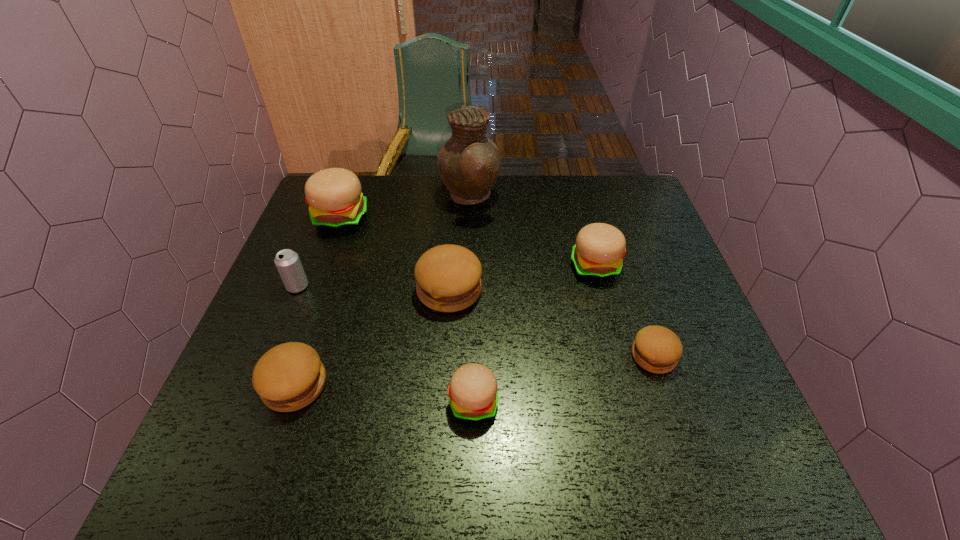
At what (x,y) coordinates should I click in order to perform the action: click on free space located on the back of the second beige hamburger from left to right. Please return your answer as a coordinate pair (x, y). Looking at the image, I should click on (475, 258).

Where is `vacant area situated 0.120m on the front of the shortest object`? vacant area situated 0.120m on the front of the shortest object is located at coordinates (678, 430).

This screenshot has width=960, height=540. Find the location of `pitcher that is at the far edge`. pitcher that is at the far edge is located at coordinates (469, 163).

At what (x,y) coordinates should I click in order to perform the action: click on hamburger that is at the far edge. Please return your answer as a coordinate pair (x, y). This screenshot has height=540, width=960. Looking at the image, I should click on (334, 196).

Identify the location of beer can that is at the left edge. (288, 264).

Image resolution: width=960 pixels, height=540 pixels. What are the coordinates of `object positioned at the far left corner` in the screenshot? It's located at (334, 196).

The image size is (960, 540). Identify the location of vacant space at the far edge. (372, 210).

Where is `free point at the left edge`? free point at the left edge is located at coordinates (309, 312).

Find the location of a particular element. vacant region at the right edge of the desktop is located at coordinates (684, 280).

You are a GUI agent. You are given a task and a screenshot of the screen. Output one action in this format:
    pyautogui.click(x=<x>, y=<y>)
    Task: Click on the vacant space at the near left corner of the desktop
    The image size is (960, 540).
    Given the screenshot: What is the action you would take?
    pyautogui.click(x=252, y=477)